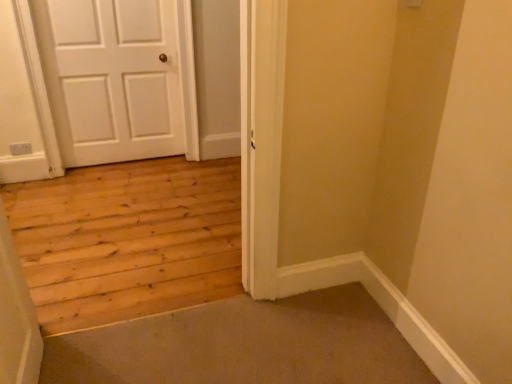
Find the location of a particular element. Image resolution: width=512 pixels, height=384 pixels. white painted wood door at upper left is located at coordinates (119, 78).

This screenshot has height=384, width=512. Describe the element at coordinates (119, 78) in the screenshot. I see `white painted wood door at upper left` at that location.

Locate an element on the screen. Image resolution: width=512 pixels, height=384 pixels. white painted wood door at upper left is located at coordinates (119, 78).